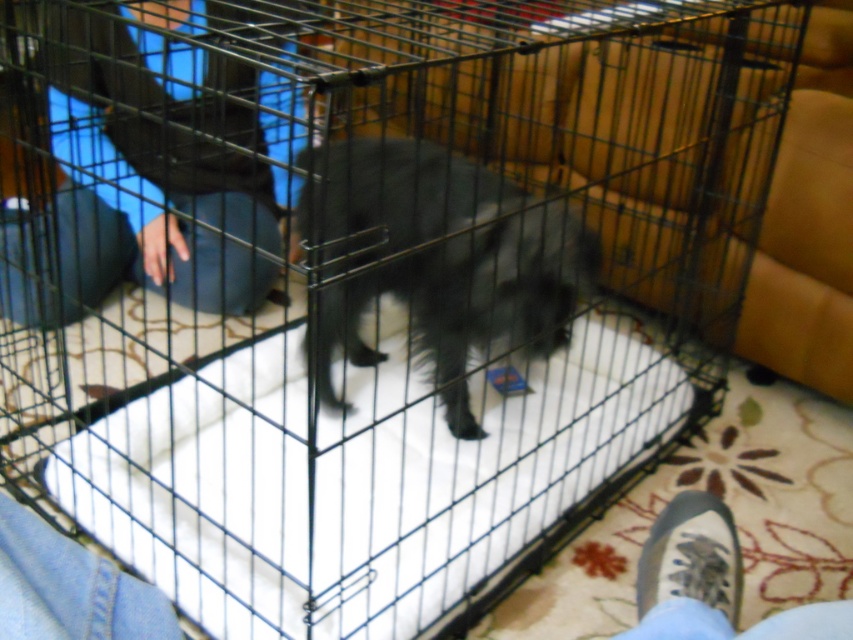
You are a delivery person who needs to place a small box on the floor near the gray fabric shoe at lower right without disturbing the black fuzzy dog at center. Considering their sizes, can you fit the box between them?

The black fuzzy dog at center is wider than the gray fabric shoe at lower right, so there should be enough space to place the small box between them as long as the box is smaller than the dog.

Based on the photo, you are a service robot in a pet store. You need to move a toy from the blue jeans at left to the black fuzzy dog at center. Which direction should you move the toy?

The blue jeans at left is on the left side of the black fuzzy dog at center, so you should move the toy to the right to reach the black fuzzy dog at center.